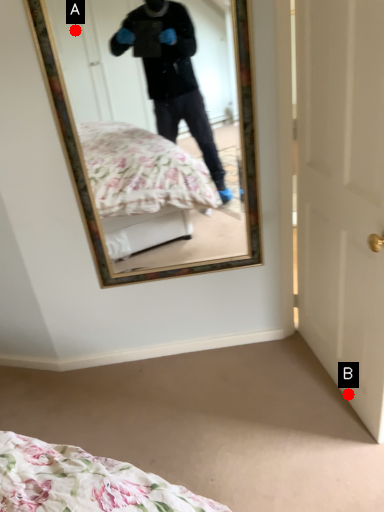
Question: Two points are circled on the image, labeled by A and B beside each circle. Which point is farther to the camera?

Choices:
 (A) A is further
 (B) B is further

Answer: (B)